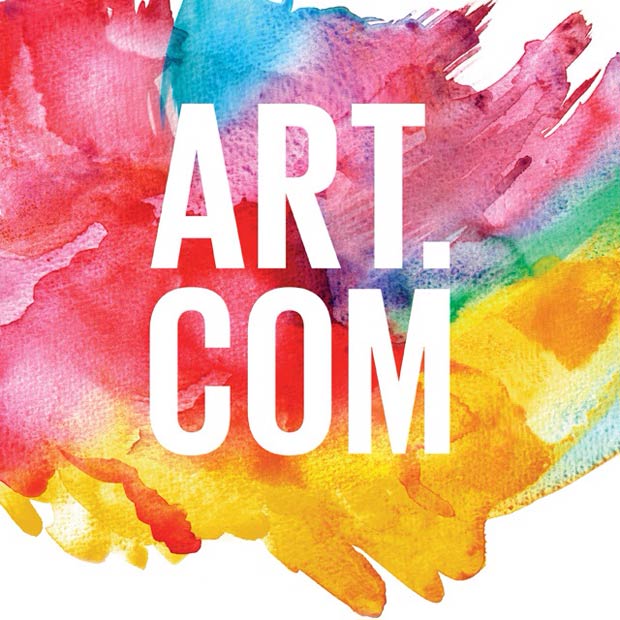
I want to click on green paint, so click(x=551, y=242).